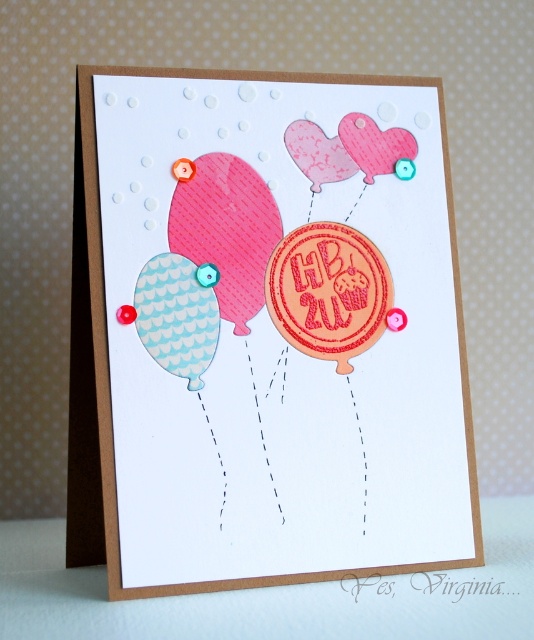
Question: Among these objects, which one is nearest to the camera?

Choices:
 (A) light blue textured balloon at left
 (B) matte pink balloon at center
 (C) textured pink balloon at center-left
 (D) textured pink heart at upper center

Answer: (B)

Question: Where is textured pink balloon at center-left located in relation to pink textured heart at upper right in the image?

Choices:
 (A) left
 (B) right

Answer: (A)

Question: Does matte pink balloon at center appear on the left side of textured pink heart at upper center?

Choices:
 (A) yes
 (B) no

Answer: (A)

Question: Which of the following is the farthest from the observer?

Choices:
 (A) (166, 364)
 (B) (223, 236)
 (C) (326, 150)
 (D) (400, 150)

Answer: (D)

Question: Based on their relative distances, which object is nearer to the pink textured heart at upper right?

Choices:
 (A) textured pink heart at upper center
 (B) matte pink balloon at center

Answer: (A)

Question: Observing the image, what is the correct spatial positioning of matte pink balloon at center in reference to textured pink balloon at center-left?

Choices:
 (A) right
 (B) left

Answer: (A)